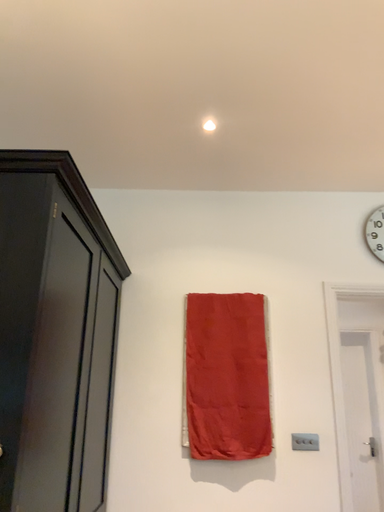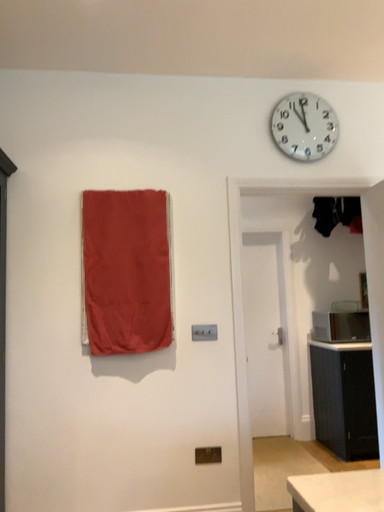
Question: How did the camera likely rotate when shooting the video?

Choices:
 (A) rotated upward
 (B) rotated downward

Answer: (B)